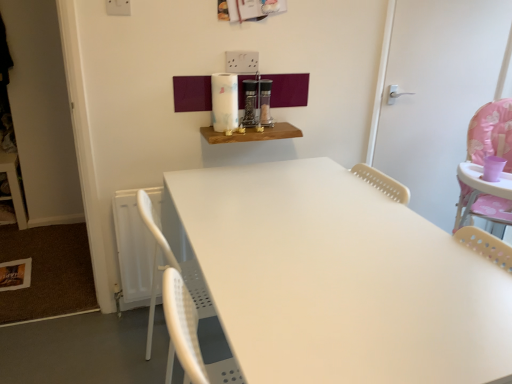
The width and height of the screenshot is (512, 384). I want to click on white plastic door at right, so click(439, 93).

What do you see at coordinates (439, 93) in the screenshot? I see `white plastic door at right` at bounding box center [439, 93].

This screenshot has height=384, width=512. I want to click on wooden shelf at upper center, so click(x=252, y=134).

What do you see at coordinates (252, 134) in the screenshot? The height and width of the screenshot is (384, 512). I see `wooden shelf at upper center` at bounding box center [252, 134].

Find the location of `white plastic door at right`. white plastic door at right is located at coordinates (439, 93).

Is wooden shelf at upper center to the right of white plastic door at right from the viewer's perspective?

In fact, wooden shelf at upper center is to the left of white plastic door at right.

Considering their positions, is wooden shelf at upper center located in front of or behind white plastic door at right?

wooden shelf at upper center is positioned closer to the viewer than white plastic door at right.

Does point (207, 135) appear closer or farther from the camera than point (480, 72)?

Point (207, 135) appears to be closer to the viewer than point (480, 72).

From the image's perspective, between wooden shelf at upper center and white plastic door at right, which one is located above?

white plastic door at right is shown above in the image.

From a real-world perspective, relative to white plastic door at right, is wooden shelf at upper center vertically above or below?

Clearly, from a real-world perspective, wooden shelf at upper center is below white plastic door at right.

Considering the sizes of objects wooden shelf at upper center and white plastic door at right in the image provided, who is wider, wooden shelf at upper center or white plastic door at right?

Wider between the two is wooden shelf at upper center.

Considering the sizes of objects wooden shelf at upper center and white plastic door at right in the image provided, who is shorter, wooden shelf at upper center or white plastic door at right?

Answer: Standing shorter between the two is wooden shelf at upper center.

Considering the relative sizes of wooden shelf at upper center and white plastic door at right in the image provided, is wooden shelf at upper center bigger than white plastic door at right?

No, wooden shelf at upper center is not bigger than white plastic door at right.

Is wooden shelf at upper center located outside white plastic door at right?

That's correct, wooden shelf at upper center is outside of white plastic door at right.

Would you consider wooden shelf at upper center to be distant from white plastic door at right?

wooden shelf at upper center is near white plastic door at right, not far away.

From the picture: Is wooden shelf at upper center positioned with its back to white plastic door at right?

That's not correct — wooden shelf at upper center is not looking away from white plastic door at right.

What's the angular difference between wooden shelf at upper center and white plastic door at right's facing directions?

They differ by 0.519 degrees in their facing directions.

Measure the distance between wooden shelf at upper center and white plastic door at right.

wooden shelf at upper center is 32.49 inches away from white plastic door at right.

Where is `table located in front of the white plastic door at right`? This screenshot has height=384, width=512. table located in front of the white plastic door at right is located at coordinates (252, 134).

Is white plastic door at right at the right side of wooden shelf at upper center?

Correct, you'll find white plastic door at right to the right of wooden shelf at upper center.

Is white plastic door at right closer to the viewer compared to wooden shelf at upper center?

No, white plastic door at right is further to the viewer.

Is point (465, 41) more distant than point (294, 127)?

That is True.

From the image's perspective, which is below, white plastic door at right or wooden shelf at upper center?

wooden shelf at upper center is shown below in the image.

From a real-world perspective, is white plastic door at right positioned over wooden shelf at upper center based on gravity?

Yes, from a real-world perspective, white plastic door at right is on top of wooden shelf at upper center.

Does white plastic door at right have a greater width compared to wooden shelf at upper center?

No.

Can you confirm if white plastic door at right is taller than wooden shelf at upper center?

Indeed, white plastic door at right has a greater height compared to wooden shelf at upper center.

Considering the sizes of objects white plastic door at right and wooden shelf at upper center in the image provided, who is smaller, white plastic door at right or wooden shelf at upper center?

wooden shelf at upper center is smaller.

Is white plastic door at right positioned beyond the bounds of wooden shelf at upper center?

white plastic door at right is positioned outside wooden shelf at upper center.

Is white plastic door at right positioned far away from wooden shelf at upper center?

No, there isn't a large distance between white plastic door at right and wooden shelf at upper center.

Is white plastic door at right facing towards wooden shelf at upper center?

No, white plastic door at right does not turn towards wooden shelf at upper center.

What's the angular difference between white plastic door at right and wooden shelf at upper center's facing directions?

0.519 degrees.

Identify the location of door above the wooden shelf at upper center (from the image's perspective). (439, 93).

Locate an element on the screen. The image size is (512, 384). table in front of the white plastic door at right is located at coordinates (252, 134).

Image resolution: width=512 pixels, height=384 pixels. Find the location of `door behind the wooden shelf at upper center`. door behind the wooden shelf at upper center is located at coordinates (439, 93).